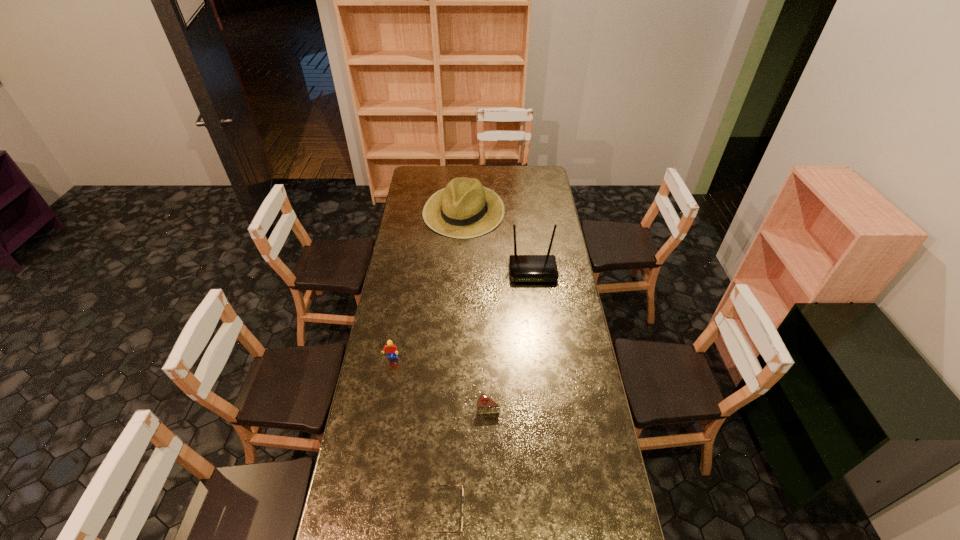
The width and height of the screenshot is (960, 540). Identify the location of free space located on the front-facing side of the tallest object. (536, 296).

Locate an element on the screen. This screenshot has height=540, width=960. free region located 0.310m on the front of the farthest object is located at coordinates (461, 279).

This screenshot has width=960, height=540. What are the coordinates of `free location located on the front-facing side of the third nearest object` in the screenshot? It's located at (378, 432).

The image size is (960, 540). I want to click on vacant point located on the back of the fourth tallest object, so point(487,334).

Find the location of `free space located on the frame of the shortest object`. free space located on the frame of the shortest object is located at coordinates (496, 512).

This screenshot has height=540, width=960. I want to click on sunhat that is at the left edge, so click(465, 208).

Where is `Lego that is positioned at the left edge`? Image resolution: width=960 pixels, height=540 pixels. Lego that is positioned at the left edge is located at coordinates (390, 348).

Where is `object that is at the right edge`? This screenshot has height=540, width=960. object that is at the right edge is located at coordinates (523, 268).

The width and height of the screenshot is (960, 540). In order to click on vacant space at the left edge in this screenshot , I will do `click(387, 462)`.

This screenshot has width=960, height=540. I want to click on vacant space at the right edge of the desktop, so click(563, 375).